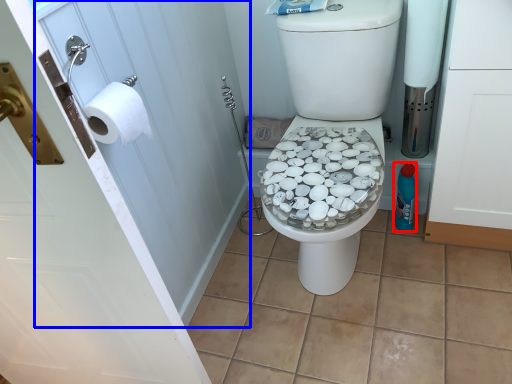
Question: Which object is further to the camera taking this photo, bottle (highlighted by a red box) or screen door (highlighted by a blue box)?

Choices:
 (A) bottle
 (B) screen door

Answer: (A)